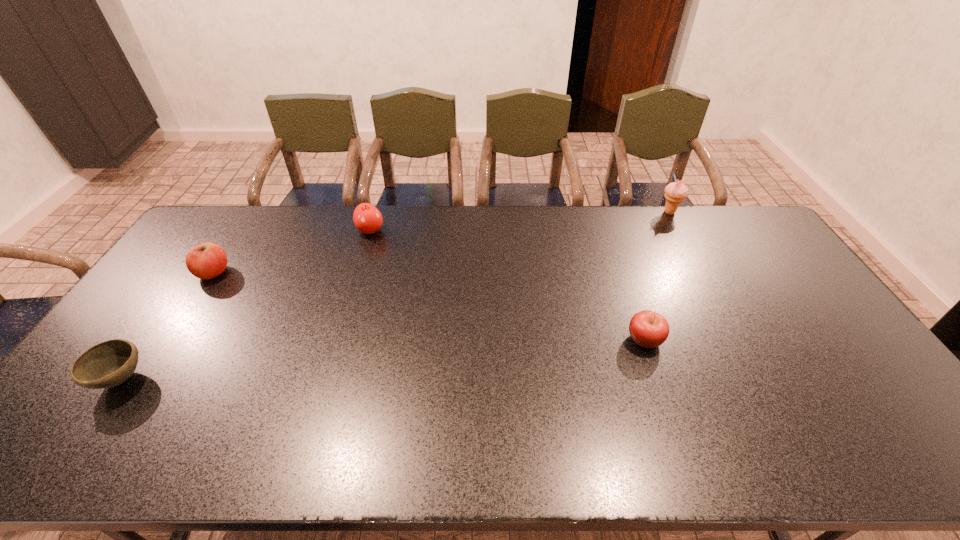
Where is `free space between the third object from left to right and the leftmost apple`? This screenshot has width=960, height=540. free space between the third object from left to right and the leftmost apple is located at coordinates (292, 252).

The width and height of the screenshot is (960, 540). Identify the location of unoccupied position between the second farthest apple and the rightmost apple. (429, 306).

At what (x,y) coordinates should I click in order to perform the action: click on vacant space that is in between the third farthest object and the fourth nearest object. Please return your answer as a coordinate pair (x, y). Image resolution: width=960 pixels, height=540 pixels. Looking at the image, I should click on (292, 252).

Select which object is the second closest to the icecream. Please provide its 2D coordinates. Your answer should be formatted as a tuple, i.e. [(x, y)], where the tuple contains the x and y coordinates of a point satisfying the conditions above.

[(367, 218)]

The width and height of the screenshot is (960, 540). What are the coordinates of `object that ranks as the second closest to the farthest object` in the screenshot? It's located at (367, 218).

Select which apple is the second closest to the third nearest object. Please provide its 2D coordinates. Your answer should be formatted as a tuple, i.e. [(x, y)], where the tuple contains the x and y coordinates of a point satisfying the conditions above.

[(648, 329)]

Locate an element on the screen. Image resolution: width=960 pixels, height=540 pixels. apple that is the third closest to the icecream is located at coordinates (208, 260).

What are the coordinates of `free location that satisfies the following two spatial constraints: 1. on the front side of the second nearest object; 2. on the left side of the fourth nearest object` in the screenshot? It's located at (338, 340).

Locate an element on the screen. vacant space that satisfies the following two spatial constraints: 1. on the front side of the nearest apple; 2. on the right side of the farthest apple is located at coordinates (338, 340).